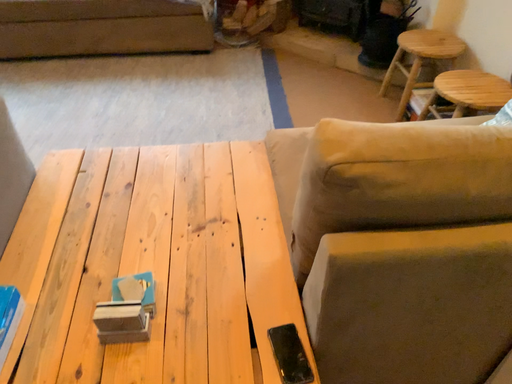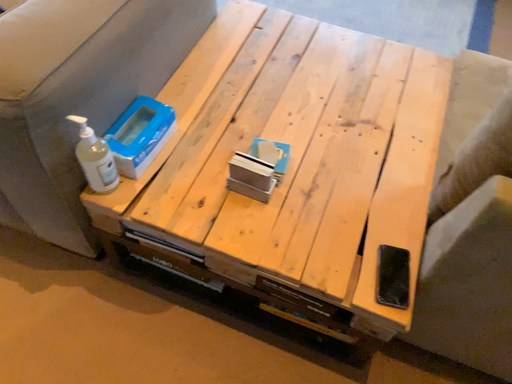
Question: Which way did the camera rotate in the video?

Choices:
 (A) rotated left
 (B) rotated right

Answer: (A)